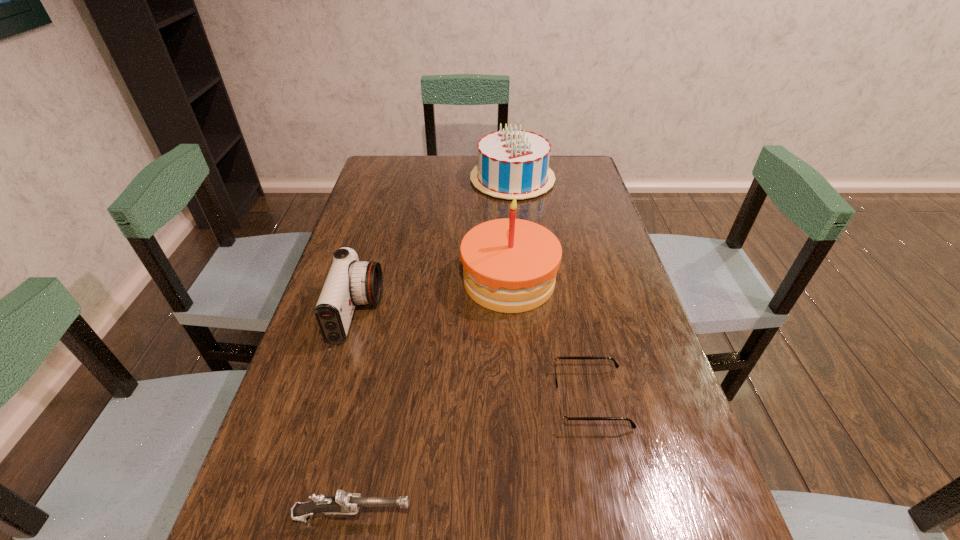
The width and height of the screenshot is (960, 540). I want to click on vacant region located on the right of the farther birthday cake, so click(571, 179).

This screenshot has height=540, width=960. In order to click on free space located 0.100m on the surface of the camcorder in this screenshot , I will do `click(420, 313)`.

Where is `free space located 0.350m aimed along the barrel of the gun`? The width and height of the screenshot is (960, 540). free space located 0.350m aimed along the barrel of the gun is located at coordinates (616, 515).

I want to click on vacant space situated at the hinge ends of the shortest object, so click(x=367, y=399).

Identify the location of vacant space located 0.210m at the hinge ends of the shortest object. (453, 399).

Locate an element on the screen. The width and height of the screenshot is (960, 540). vacant space located at the hinge ends of the shortest object is located at coordinates (424, 399).

I want to click on object located in the far edge section of the desktop, so click(513, 163).

I want to click on camcorder that is at the left edge, so click(350, 282).

You are a GUI agent. You are given a task and a screenshot of the screen. Output one action in this format:
    pyautogui.click(x=<x>, y=<y>)
    Task: Click on the gun at the left edge
    
    Given the screenshot: What is the action you would take?
    pyautogui.click(x=342, y=503)

At what (x,y) coordinates should I click in order to perform the action: click on birthday cake positioned at the right edge. Please return your answer as a coordinate pair (x, y). Image resolution: width=960 pixels, height=540 pixels. Looking at the image, I should click on (513, 163).